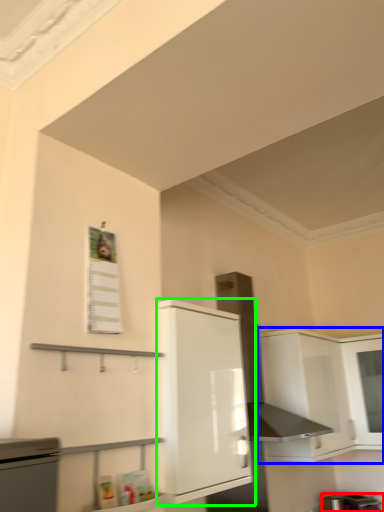
Question: Estimate the real-world distances between objects in this image. Which object is farther from appliance (highlighted by a red box), cabinetry (highlighted by a blue box) or cabinetry (highlighted by a green box)?

Choices:
 (A) cabinetry
 (B) cabinetry

Answer: (B)